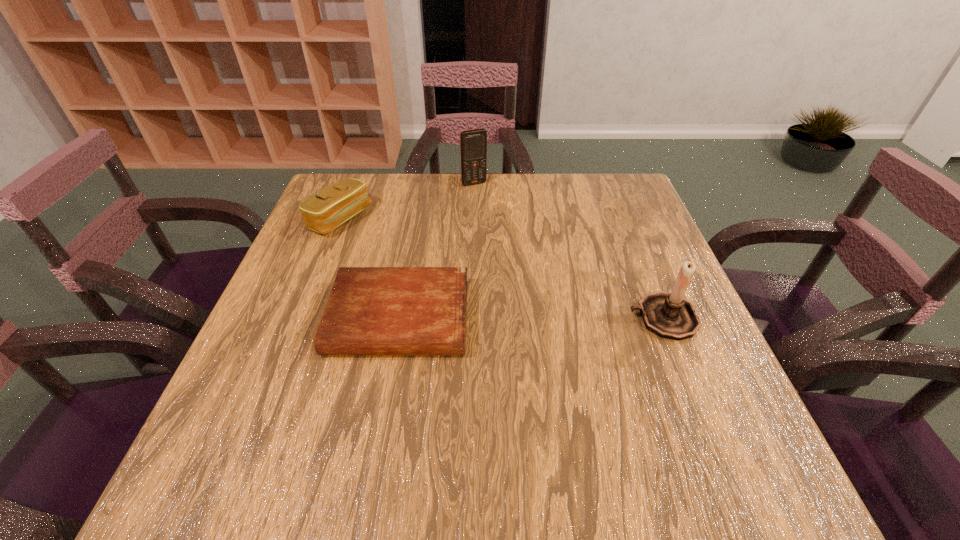
The width and height of the screenshot is (960, 540). Find the location of `vacant space in between the farthest object and the Bible`. vacant space in between the farthest object and the Bible is located at coordinates (437, 251).

Locate an element on the screen. The height and width of the screenshot is (540, 960). blank region between the farthest object and the rightmost object is located at coordinates [x=568, y=251].

The width and height of the screenshot is (960, 540). I want to click on vacant space that is in between the cellular telephone and the shortest object, so click(x=437, y=251).

Identify which object is the second nearest to the shortest object. Please provide its 2D coordinates. Your answer should be formatted as a tuple, i.e. [(x, y)], where the tuple contains the x and y coordinates of a point satisfying the conditions above.

[(668, 315)]

At what (x,y) coordinates should I click in order to perform the action: click on the closest object to the rightmost object. Please return your answer as a coordinate pair (x, y). The height and width of the screenshot is (540, 960). Looking at the image, I should click on (371, 310).